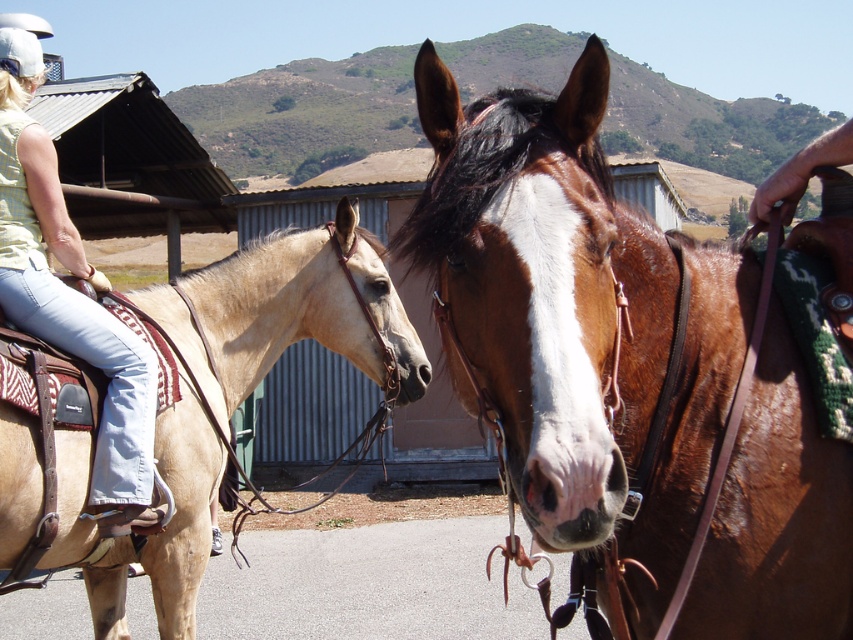
Based on the photo, you are a photographer standing at the position of the denim jeans at left. You want to take a photo of the brown glossy horse at center. Considering the distance between you and the horse, would you need a zoom lens to capture the horse clearly in your shot?

The brown glossy horse at center is 2.24 meters away from denim jeans at left. Since the distance is moderate, a standard lens might suffice, but using a zoom lens could help ensure the horse is the focal point of the image without cropping too much.

You are a photographer trying to capture a closeup of the light tan leather saddle at left without including the denim jeans at left in the frame. Based on their positions, is this possible?

The light tan leather saddle at left is located below denim jeans at left, so adjusting the camera angle to focus on the lower part of the frame where the saddle is positioned would exclude the denim jeans at left.

You are a rider preparing to mount your horse. You notice the brown glossy horse at center and the light tan leather saddle at left. Which object is narrower when viewed from above?

The brown glossy horse at center is thinner than the light tan leather saddle at left, so the brown glossy horse at center is narrower when viewed from above.